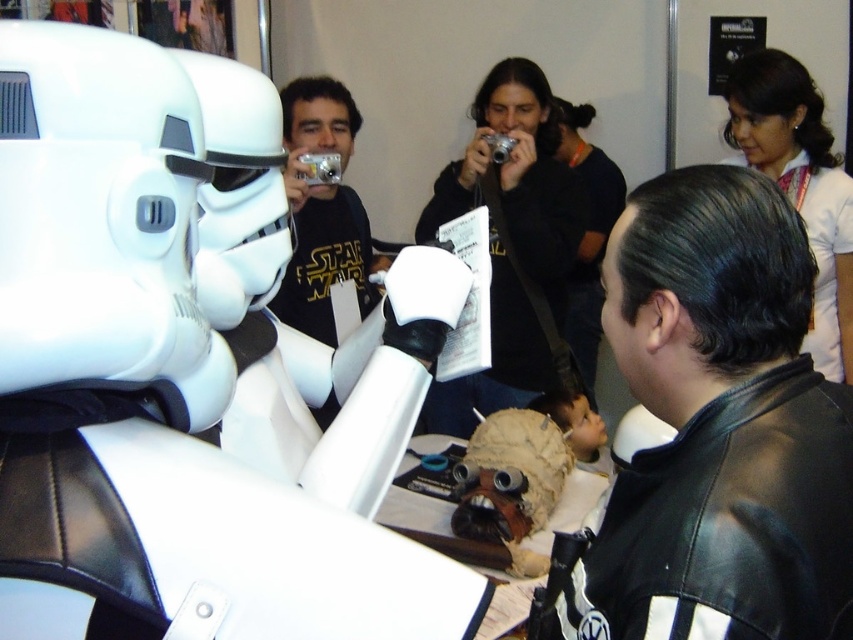
Question: Is black leather jacket at center above matte black jacket at center?

Choices:
 (A) no
 (B) yes

Answer: (A)

Question: Which point is closer to the camera?

Choices:
 (A) smooth skin nose at upper center
 (B) white shirt at upper right
 (C) matte black jacket at center
 (D) dark hair at upper center

Answer: (B)

Question: Is the position of dark hair at upper center less distant than that of smooth skin nose at upper center?

Choices:
 (A) no
 (B) yes

Answer: (A)

Question: Which of these objects is positioned closest to the matte black nose at center?

Choices:
 (A) matte black jacket at center
 (B) black matte t-shirt at center

Answer: (A)

Question: Which is farther from the dark hair at upper center?

Choices:
 (A) black matte t-shirt at center
 (B) black leather jacket at center

Answer: (B)

Question: Observing the image, what is the correct spatial positioning of black leather jacket at center in reference to matte black jacket at center?

Choices:
 (A) right
 (B) left

Answer: (A)